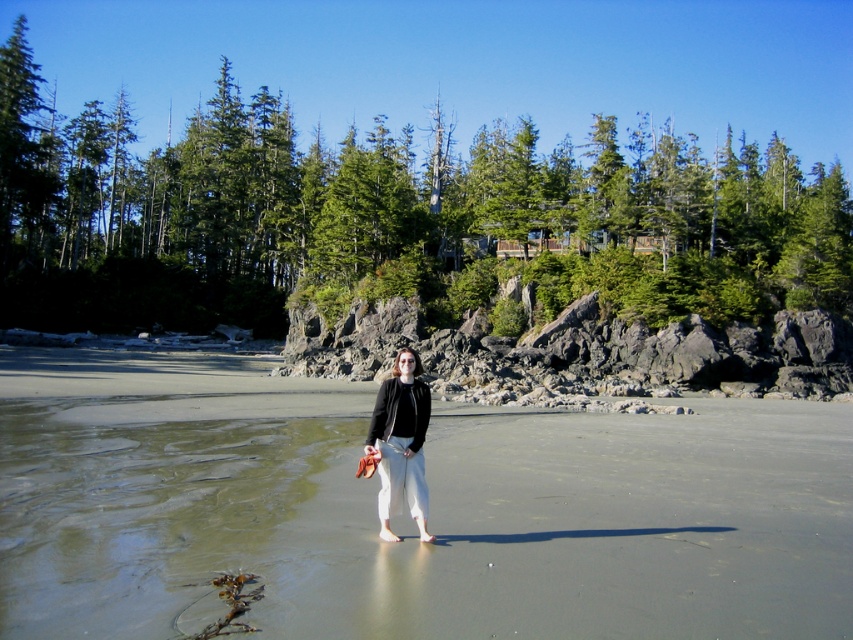
Is smooth sand beach at center above matte black jacket at center?

No, smooth sand beach at center is not above matte black jacket at center.

Is point (714, 621) in front of point (386, 452)?

Yes, it is.

The width and height of the screenshot is (853, 640). Find the location of `smooth sand beach at center`. smooth sand beach at center is located at coordinates (405, 515).

Is green matte pine at upper center closer to camera compared to matte black jacket at center?

No, it is behind matte black jacket at center.

Does point (433, 211) come in front of point (410, 371)?

No, (433, 211) is further to viewer.

Identify the location of green matte pine at upper center. The image size is (853, 640). (387, 216).

Can you confirm if smooth sand beach at center is thinner than green matte pine at upper center?

Yes, smooth sand beach at center is thinner than green matte pine at upper center.

Is point (550, 524) farther from camera compared to point (210, 216)?

No, (550, 524) is in front of (210, 216).

I want to click on smooth sand beach at center, so click(405, 515).